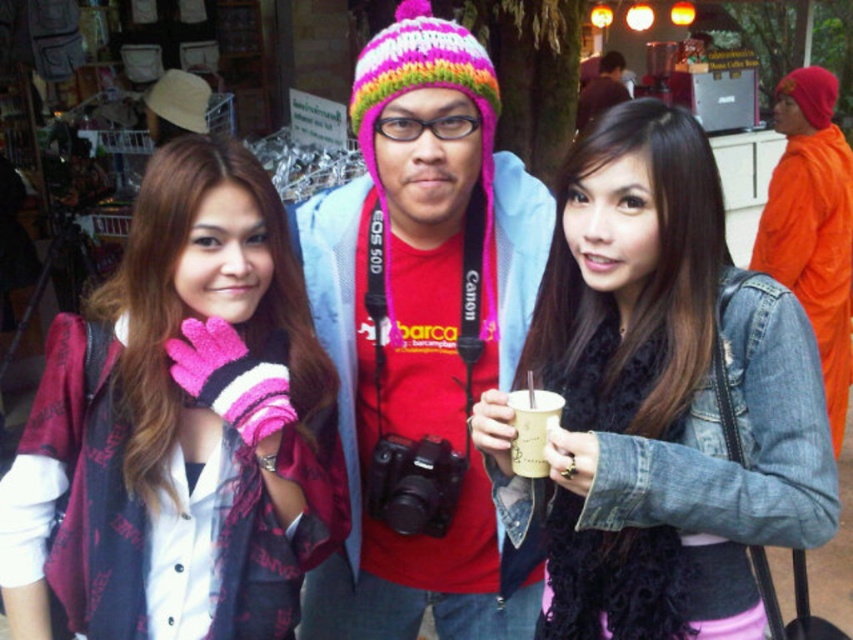
Question: Which of the following is the closest to the observer?

Choices:
 (A) denim jacket at center
 (B) white paper cup at center
 (C) orange cloth at right

Answer: (A)

Question: Is pink knitted gloves at center positioned at the back of orange cloth at right?

Choices:
 (A) yes
 (B) no

Answer: (B)

Question: Which point is farther to the camera?

Choices:
 (A) (445, 432)
 (B) (512, 444)
 (C) (54, 428)
 (D) (793, 93)

Answer: (D)

Question: Does denim jacket at center have a greater width compared to knitted woolen hat at center?

Choices:
 (A) yes
 (B) no

Answer: (B)

Question: Is denim jacket at center positioned behind orange cloth at right?

Choices:
 (A) no
 (B) yes

Answer: (A)

Question: Which object appears closest to the camera in this image?

Choices:
 (A) pink knitted gloves at center
 (B) denim jacket at center
 (C) white paper cup at center

Answer: (B)